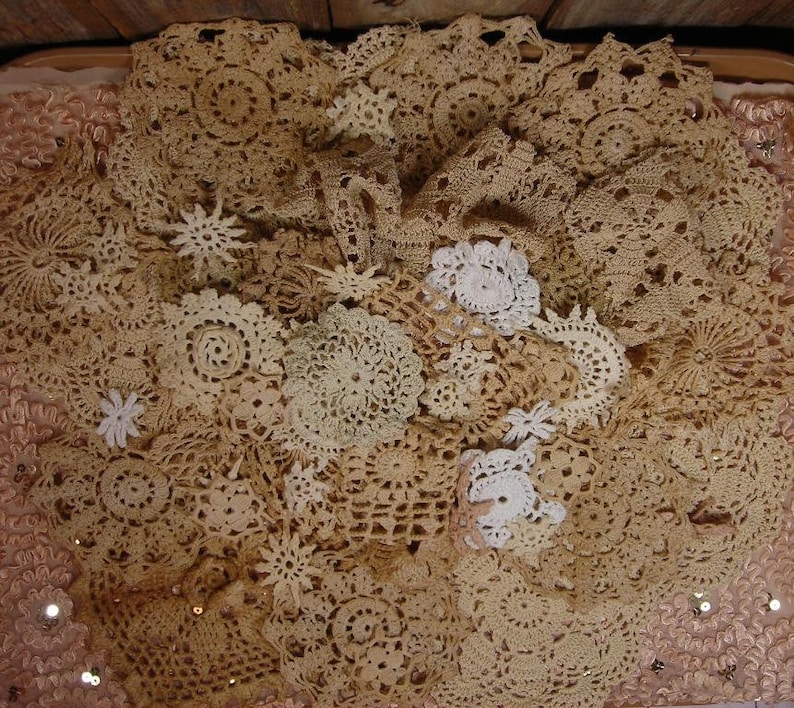
Identify the location of doily. This screenshot has height=708, width=794. (499, 275).